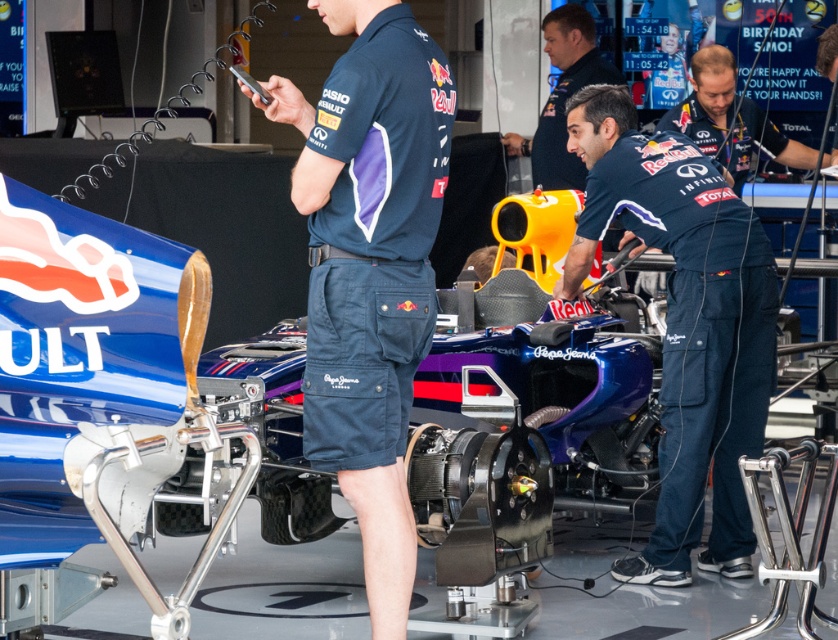
You are a photographer positioned at the back of the pit lane. You need to take a photo of both the matte blue jumpsuit at center and the dark blue uniform at center. Which one should you adjust your camera focus to first to ensure both are in the frame?

The matte blue jumpsuit at center is to the left of dark blue uniform at center, so you should focus on the dark blue uniform at center first to ensure both are in the frame.

You are a photographer standing in the pit lane and need to capture a photo of the matte blue jumpsuit at center and the dark blue uniform at center without any overlap. Given that your camera has a maximum focus range of 5 meters, can you achieve this shot?

The matte blue jumpsuit at center is 5.06 meters from the dark blue uniform at center. Since the distance exceeds the camera maximum focus range of 5 meters, the photographer cannot capture both subjects in focus without overlap.

From the picture: You are standing in the pit lane and want to take a photo of the Formula One race car. You notice two points on the car labeled as point 1 and point 2. If point 1 is at coordinate [711,99] and point 2 is at [554,96], which point will appear larger in your photo?

Point 1 at coordinate [711,99] will appear larger in the photo because it is closer to the camera than point 2 at [554,96].